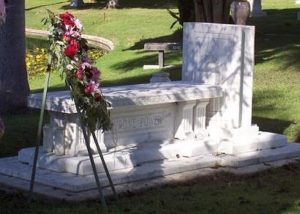
At what (x,y) coordinates should I click in order to perform the action: click on stand. Please return your answer as a coordinate pair (x, y). The image size is (300, 214). Looking at the image, I should click on (43, 102), (93, 168), (105, 167).